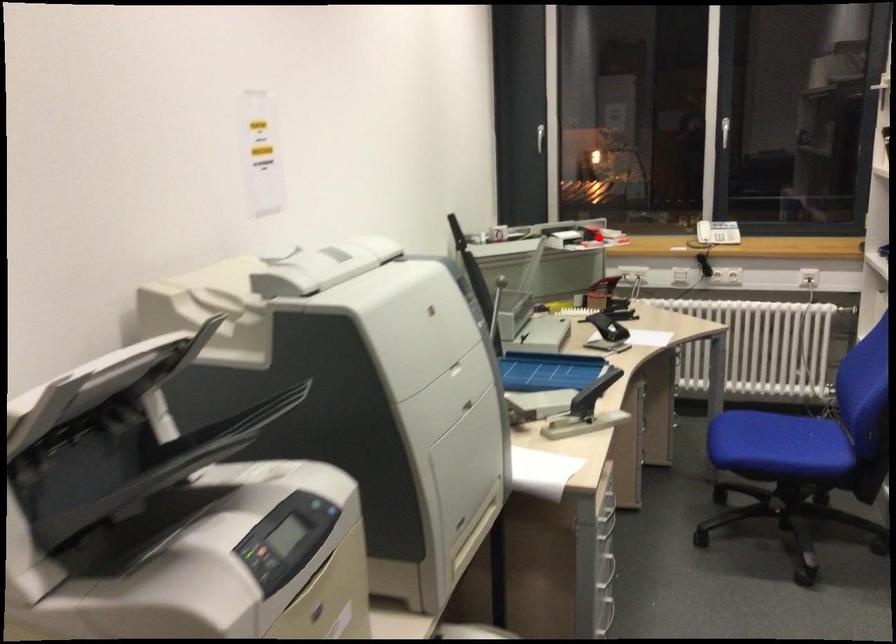
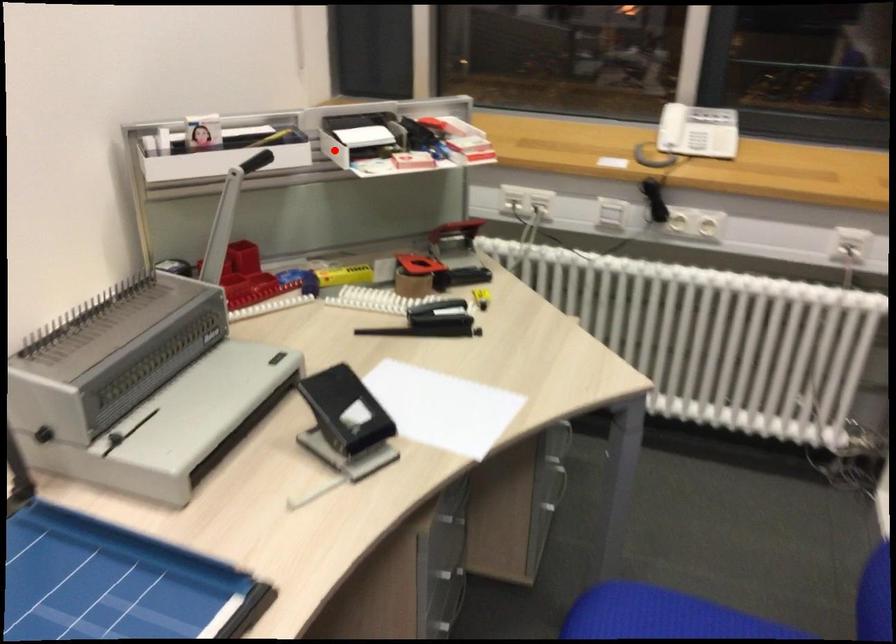
I am providing you with two images of the same scene from different viewpoints. A red point is marked on the first image and another point is marked on the second image. Is the marked point in image1 the same physical position as the marked point in image2?

No